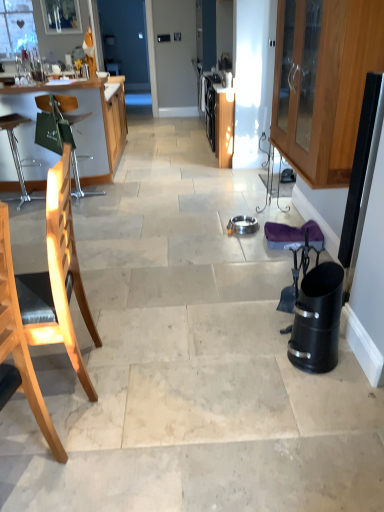
Identify the location of vacant space to the left of black plastic swivel chair at right. This screenshot has width=384, height=512. (260, 330).